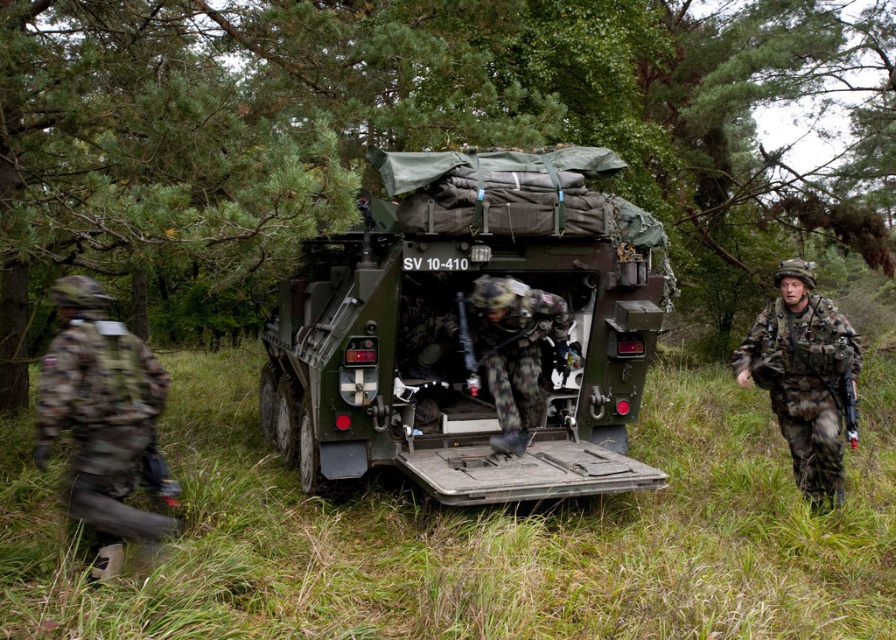
Can you confirm if camouflage fabric uniform at right is shorter than camouflage fabric uniform at center?

No.

Between camouflage fabric uniform at right and camouflage fabric uniform at center, which one appears on the left side from the viewer's perspective?

Positioned to the left is camouflage fabric uniform at center.

Identify the location of camouflage fabric uniform at right. This screenshot has height=640, width=896. (803, 376).

From the picture: Can you confirm if green grassy at center is smaller than camouflage fabric uniform at right?

No, green grassy at center is not smaller than camouflage fabric uniform at right.

Can you confirm if green grassy at center is thinner than camouflage fabric uniform at right?

→ No, green grassy at center is not thinner than camouflage fabric uniform at right.

This screenshot has height=640, width=896. What do you see at coordinates (472, 532) in the screenshot? I see `green grassy at center` at bounding box center [472, 532].

This screenshot has height=640, width=896. In order to click on green grassy at center in this screenshot , I will do pos(472,532).

Between camouflage fabric uniform at left and camouflage fabric uniform at right, which one appears on the right side from the viewer's perspective?

camouflage fabric uniform at right is more to the right.

Which is above, camouflage fabric uniform at left or camouflage fabric uniform at right?

camouflage fabric uniform at right is above.

Who is more forward, (97, 301) or (824, 404)?

Point (97, 301) is in front.

Where is `camouflage fabric uniform at left`? This screenshot has width=896, height=640. camouflage fabric uniform at left is located at coordinates (101, 417).